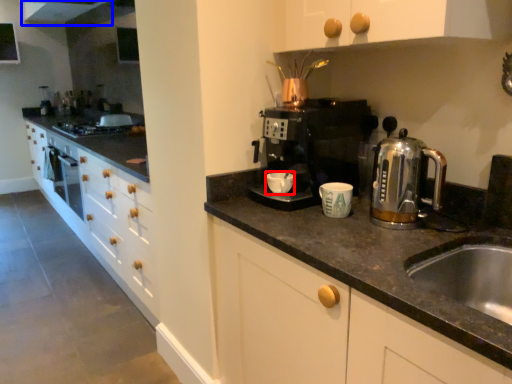
Question: Which point is closer to the camera, mug (highlighted by a red box) or exhaust hood (highlighted by a blue box)?

Choices:
 (A) mug
 (B) exhaust hood

Answer: (A)